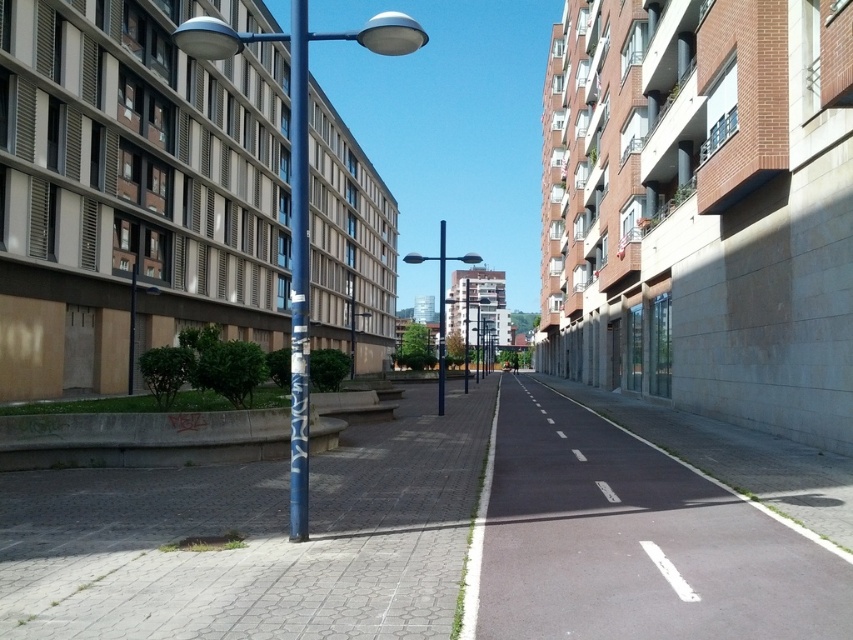
Does black asphalt bike lane at center have a lesser height compared to blue painted metal pole at center?

Indeed, black asphalt bike lane at center has a lesser height compared to blue painted metal pole at center.

Is black asphalt bike lane at center bigger than blue painted metal pole at center?

Incorrect, black asphalt bike lane at center is not larger than blue painted metal pole at center.

The width and height of the screenshot is (853, 640). I want to click on black asphalt bike lane at center, so click(635, 540).

Can you confirm if black asphalt bike lane at center is thinner than smooth blue pole at center?

In fact, black asphalt bike lane at center might be wider than smooth blue pole at center.

Identify the location of black asphalt bike lane at center. The image size is (853, 640). (635, 540).

Which is behind, point (451, 572) or point (294, 500)?

Positioned behind is point (294, 500).

Who is more forward, (x=111, y=550) or (x=402, y=13)?

Point (x=111, y=550)

Which is behind, point (263, 513) or point (228, 48)?

The point (263, 513) is more distant.

This screenshot has width=853, height=640. In order to click on gray brick pavement at lower left in this screenshot , I will do `click(254, 540)`.